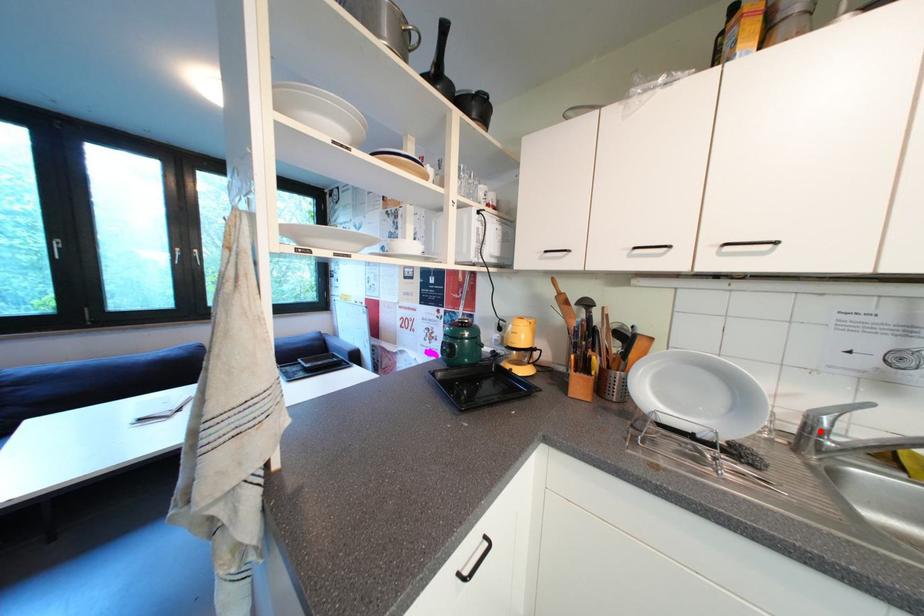
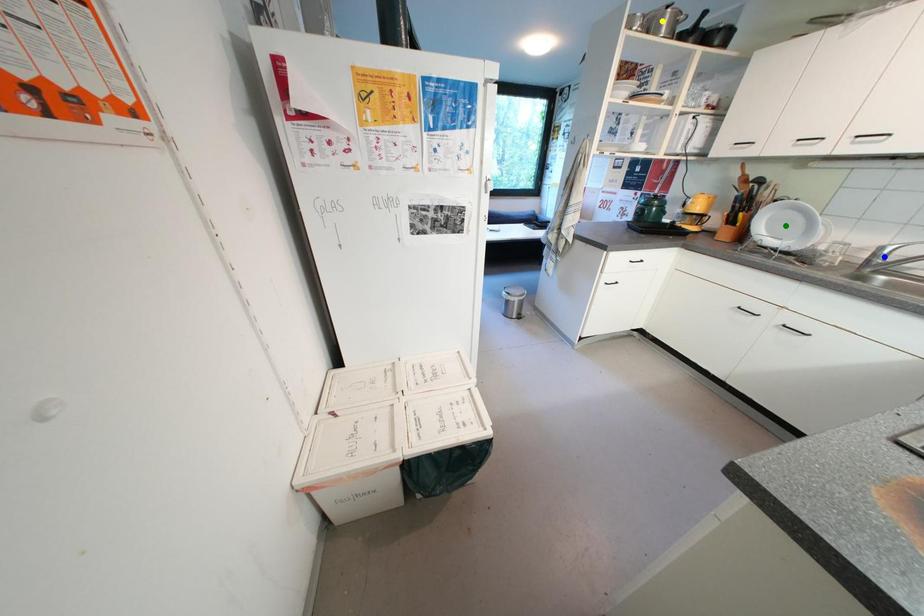
Question: I am providing you with two images of the same scene from different viewpoints. A red point is marked on the first image. You are given multiple points on the second image. Which mark in image 2 goes with the point in image 1?

Choices:
 (A) blue point
 (B) yellow point
 (C) green point

Answer: (A)